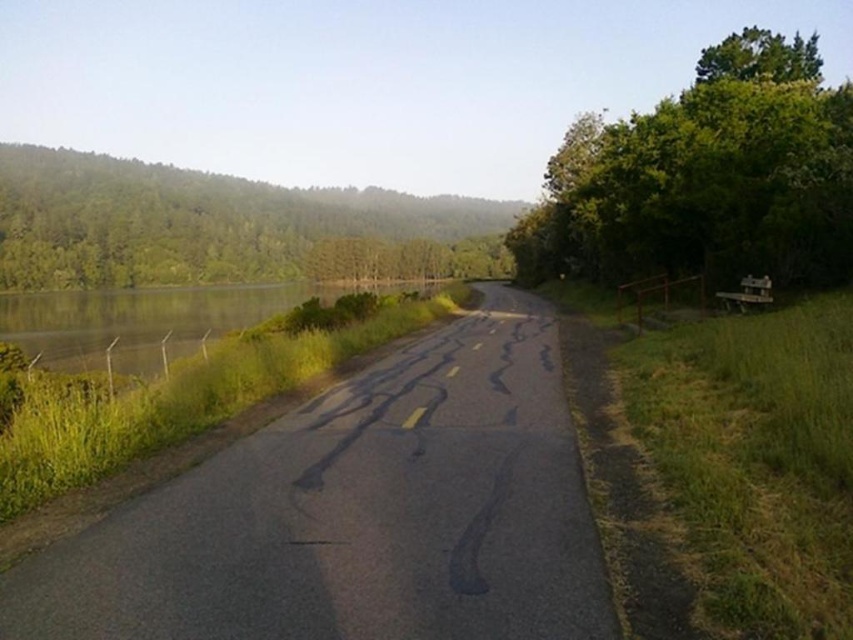
Question: Among these objects, which one is nearest to the camera?

Choices:
 (A) green leafy trees at upper left
 (B) green grassy water at left

Answer: (B)

Question: Among these objects, which one is nearest to the camera?

Choices:
 (A) green grassy water at left
 (B) green leafy tree at right
 (C) asphalt road at left
 (D) green leafy trees at upper left

Answer: (C)

Question: From the image, what is the correct spatial relationship of green leafy tree at right in relation to green grassy water at left?

Choices:
 (A) below
 (B) above

Answer: (B)

Question: Does asphalt road at left have a greater width compared to green grassy water at left?

Choices:
 (A) yes
 (B) no

Answer: (B)

Question: Which object is farther from the camera taking this photo?

Choices:
 (A) green leafy tree at right
 (B) green grassy water at left
 (C) asphalt road at left
 (D) green leafy trees at upper left

Answer: (D)

Question: Can you confirm if asphalt road at left is positioned above green leafy trees at upper left?

Choices:
 (A) no
 (B) yes

Answer: (A)